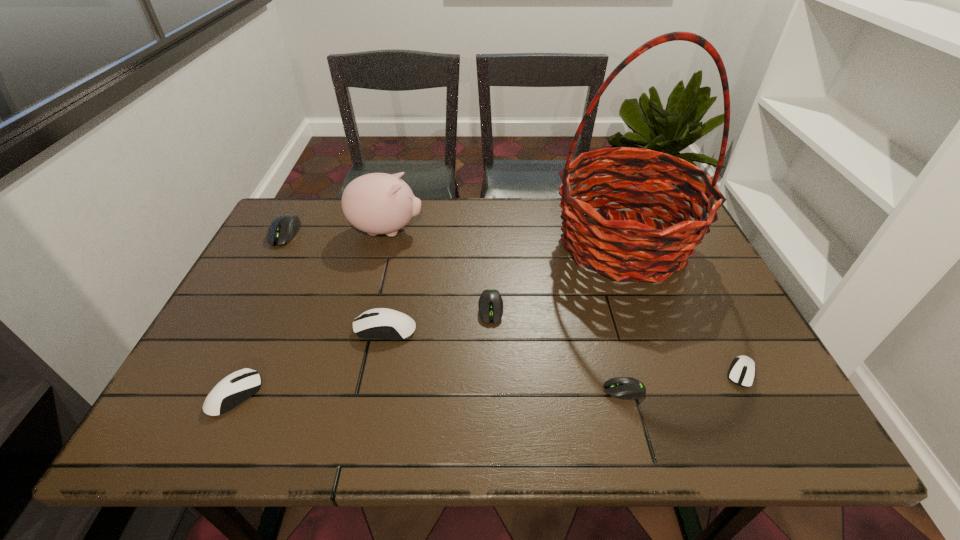
At what (x,y) coordinates should I click in order to perform the action: click on the smallest white mouse. Please return your answer as a coordinate pair (x, y). This screenshot has width=960, height=540. Looking at the image, I should click on (742, 371).

Locate an element on the screen. This screenshot has height=540, width=960. the second computer mouse from right to left is located at coordinates (627, 388).

Identify the location of the nearest gray computer mouse. (627, 388).

The width and height of the screenshot is (960, 540). I want to click on vacant space located 0.060m on the left of the basket, so click(532, 243).

Find the location of a particular element. This screenshot has width=960, height=540. blank space located 0.230m at the snout of the seventh shortest object is located at coordinates (498, 231).

Where is `free space located on the front of the third computer mouse from left to right`? free space located on the front of the third computer mouse from left to right is located at coordinates (372, 394).

Image resolution: width=960 pixels, height=540 pixels. What are the coordinates of `vacant space located on the wheel side of the farthest computer mouse` in the screenshot? It's located at (245, 308).

You are a GUI agent. You are given a task and a screenshot of the screen. Output one action in this format:
    pyautogui.click(x=<x>, y=<y>)
    Task: Click on the free point located on the right of the leftmost white mouse
    This screenshot has width=960, height=540.
    Given the screenshot: What is the action you would take?
    pyautogui.click(x=329, y=395)

Locate an element on the screen. Image resolution: width=960 pixels, height=540 pixels. free space located on the wheel side of the second gray computer mouse from left to right is located at coordinates (x=493, y=429).

Find the location of `vacant space positioned on the back of the rightmost white mouse`. vacant space positioned on the back of the rightmost white mouse is located at coordinates (692, 278).